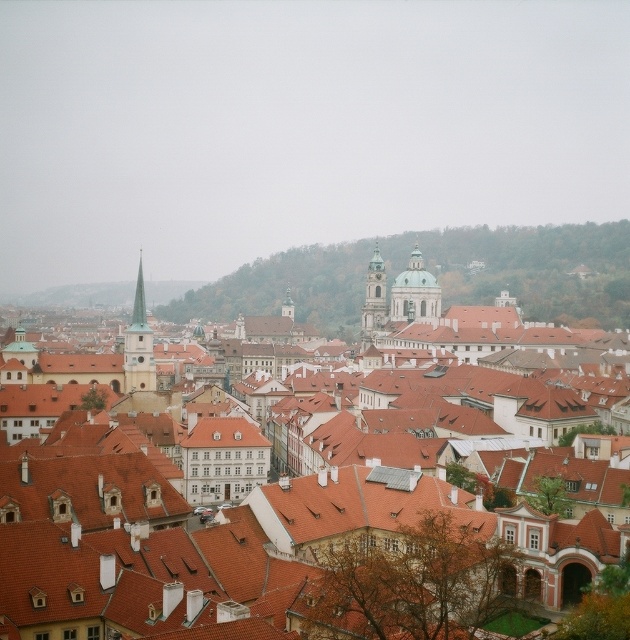
Question: Which point appears closest to the camera in this image?

Choices:
 (A) (277, 605)
 (B) (151, 344)
 (C) (413, 260)
 (D) (135, 291)

Answer: (A)

Question: Does smooth stone tower at center have a larger size compared to green glass spire at center?

Choices:
 (A) no
 (B) yes

Answer: (A)

Question: Is smooth white spire at center-left to the right of smooth stone tower at center from the viewer's perspective?

Choices:
 (A) yes
 (B) no

Answer: (B)

Question: Which point appears closest to the camera in this image?

Choices:
 (A) (140, 253)
 (B) (217, 448)

Answer: (B)

Question: Is gold domed tower at center to the right of smooth stone tower at center from the viewer's perspective?

Choices:
 (A) no
 (B) yes

Answer: (B)

Question: Which object appears closest to the camera in this image?

Choices:
 (A) gold domed tower at center
 (B) green glass spire at center
 (C) smooth white spire at center-left
 (D) reddish-brown tiled roofs at center

Answer: (D)